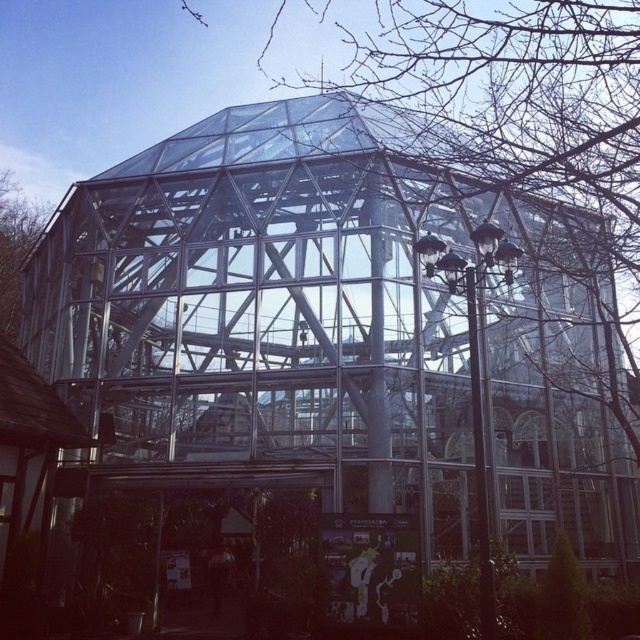
Is transparent glass dome at center shorter than brown wood tree at left?

No.

The image size is (640, 640). Find the location of `transparent glass dome at center`. transparent glass dome at center is located at coordinates (529, 106).